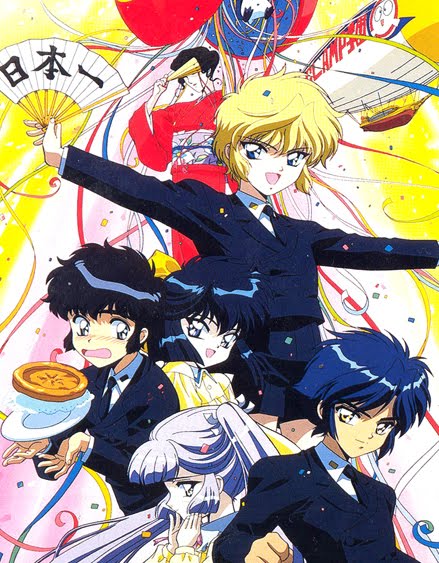
Where is `plate`? This screenshot has width=439, height=563. plate is located at coordinates (50, 424).